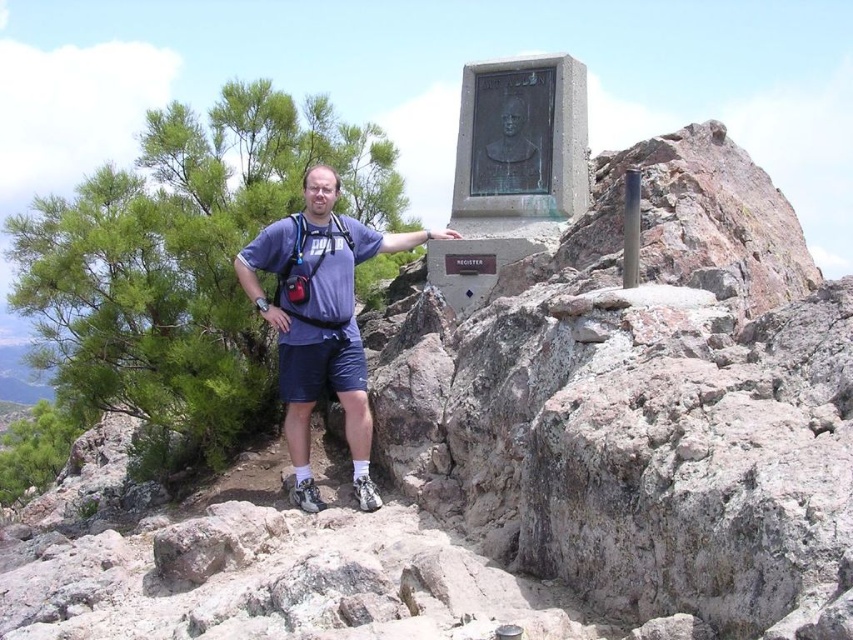
Question: Considering the real-world distances, which object is closest to the bronze bust at upper center?

Choices:
 (A) green leafy pine at left
 (B) matte blue shirt at center

Answer: (B)

Question: Which object is closer to the camera taking this photo?

Choices:
 (A) green leafy pine at left
 (B) matte blue shirt at center

Answer: (B)

Question: Is matte blue shirt at center closer to the viewer compared to bronze bust at upper center?

Choices:
 (A) no
 (B) yes

Answer: (B)

Question: Can you confirm if matte blue shirt at center is positioned above bronze bust at upper center?

Choices:
 (A) yes
 (B) no

Answer: (B)

Question: Is green leafy pine at left to the right of bronze bust at upper center from the viewer's perspective?

Choices:
 (A) yes
 (B) no

Answer: (B)

Question: Which point is farther from the camera taking this photo?

Choices:
 (A) (526, 161)
 (B) (163, 212)

Answer: (B)